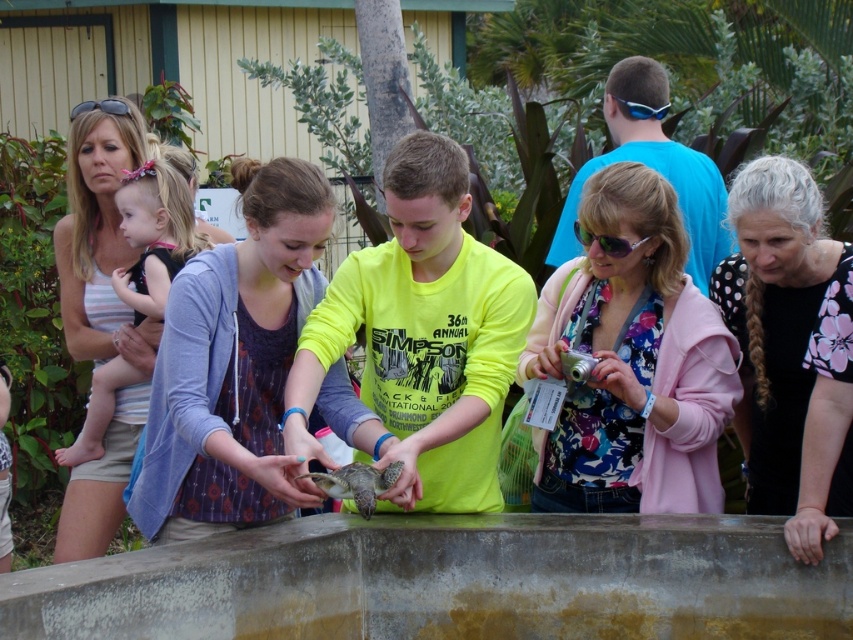
You are a photographer trying to capture a closeup of the floral fabric shirt at center and the matte purple dress at center. Which one should you zoom in on first to ensure it appears larger in your photo?

The floral fabric shirt at center should be zoomed in on first because it is closer to the viewer than the matte purple dress at center, making it appear larger.

You are a park ranger who needs to place a 20 inch wide safety barrier between the concrete ledge at center and the smooth green turtle at center. Is there enough space to place it without moving either object?

The concrete ledge at center and smooth green turtle at center are 18.70 inches apart from each other. Since the safety barrier is 20 inches wide, which is wider than the space between them, it won not fit without moving either object.

You are a photographer trying to capture the snake and the boy in the scene. You notice two points marked in the image. One is at coordinate point (614, 406) and the other at point (271, 232). Which point is closer to the photographer?

Point (271, 232) is closer to the photographer because point (614, 406) is behind it.